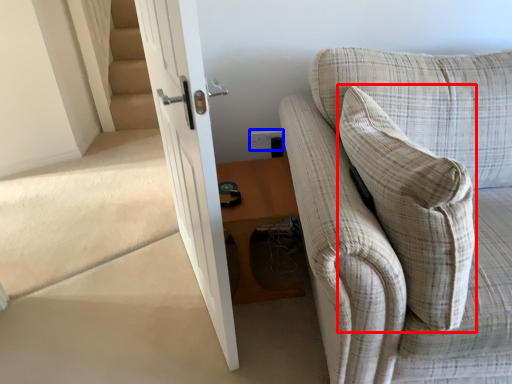
Question: Which object appears closest to the camera in this image, throw pillow (highlighted by a red box) or electric outlet (highlighted by a blue box)?

Choices:
 (A) throw pillow
 (B) electric outlet

Answer: (A)